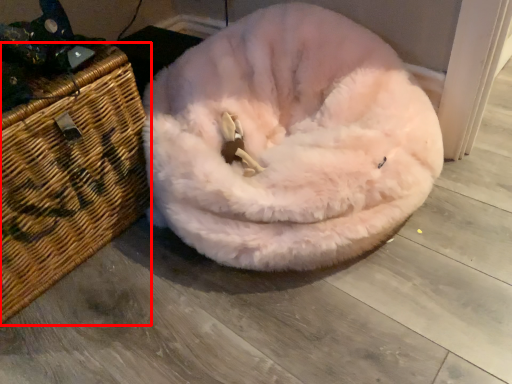
Question: Where is basket (annotated by the red box) located in relation to dog bed in the image?

Choices:
 (A) left
 (B) right

Answer: (A)